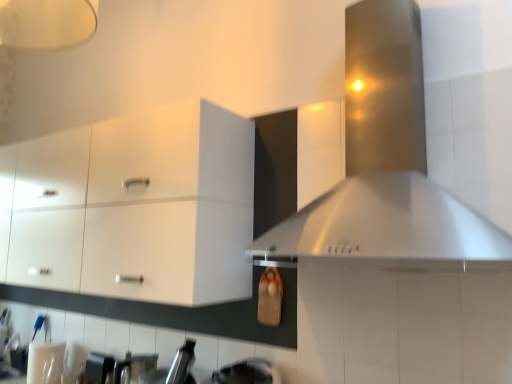
Find the location of a particular element. This screenshot has height=384, width=512. white glossy cabinet at upper left is located at coordinates pos(134,207).

What do you see at coordinates (98, 368) in the screenshot? I see `metallic silver toaster at lower left` at bounding box center [98, 368].

Locate an element on the screen. The width and height of the screenshot is (512, 384). white glossy cabinet at upper left is located at coordinates (134, 207).

Does point (104, 361) come closer to viewer compared to point (99, 273)?

No, it is not.

From a real-world perspective, which object stands above the other?

In real-world perspective, white glossy cabinet at upper left is above.

Measure the distance from metallic silver toaster at lower left to white glossy cabinet at upper left.

36.30 inches.

Based on their positions, is metallic silver toaster at lower left located to the left or right of white glossy cabinet at upper left?

From the image, it's evident that metallic silver toaster at lower left is to the right of white glossy cabinet at upper left.

Which is in front, stainless steel vent at upper right or metallic silver toaster at lower left?

Positioned in front is stainless steel vent at upper right.

At what (x,y) coordinates should I click in order to perform the action: click on appliance to the left of stainless steel vent at upper right. Please return your answer as a coordinate pair (x, y). Looking at the image, I should click on (98, 368).

Considering the sizes of stainless steel vent at upper right and metallic silver toaster at lower left in the image, is stainless steel vent at upper right wider or thinner than metallic silver toaster at lower left?

Clearly, stainless steel vent at upper right has more width compared to metallic silver toaster at lower left.

What's the angular difference between stainless steel vent at upper right and metallic silver toaster at lower left's facing directions?

The facing directions of stainless steel vent at upper right and metallic silver toaster at lower left are 0.855 degrees apart.

Looking at the image, does metallic silver toaster at lower left seem bigger or smaller compared to stainless steel vent at upper right?

In the image, metallic silver toaster at lower left appears to be smaller than stainless steel vent at upper right.

From the picture: From the image's perspective, between metallic silver toaster at lower left and stainless steel vent at upper right, which one is located above?

stainless steel vent at upper right appears higher in the image.

The height and width of the screenshot is (384, 512). Identify the location of appliance behind the stainless steel vent at upper right. (98, 368).

From a real-world perspective, between metallic silver toaster at lower left and stainless steel vent at upper right, who is vertically lower?

metallic silver toaster at lower left.

From the image's perspective, is white glossy cabinet at upper left on metallic silver toaster at lower left?

Correct, white glossy cabinet at upper left appears higher than metallic silver toaster at lower left in the image.

Is white glossy cabinet at upper left not within metallic silver toaster at lower left?

Yes, white glossy cabinet at upper left is not within metallic silver toaster at lower left.

Where is `appliance on the right of white glossy cabinet at upper left`? Image resolution: width=512 pixels, height=384 pixels. appliance on the right of white glossy cabinet at upper left is located at coordinates (98, 368).

Considering the relative sizes of white glossy cabinet at upper left and metallic silver toaster at lower left in the image provided, is white glossy cabinet at upper left wider than metallic silver toaster at lower left?

Yes, white glossy cabinet at upper left is wider than metallic silver toaster at lower left.

Considering the positions of objects stainless steel vent at upper right and white glossy cabinet at upper left in the image provided, who is in front, stainless steel vent at upper right or white glossy cabinet at upper left?

Positioned in front is stainless steel vent at upper right.

Looking at the image, does stainless steel vent at upper right seem bigger or smaller compared to white glossy cabinet at upper left?

In the image, stainless steel vent at upper right appears to be smaller than white glossy cabinet at upper left.

From the image's perspective, is stainless steel vent at upper right under white glossy cabinet at upper left?

No.

Where is `cabinetry behind the stainless steel vent at upper right`? Image resolution: width=512 pixels, height=384 pixels. cabinetry behind the stainless steel vent at upper right is located at coordinates (134, 207).

Which is correct: white glossy cabinet at upper left is inside stainless steel vent at upper right, or outside of it?

white glossy cabinet at upper left is not enclosed by stainless steel vent at upper right.

In terms of width, does white glossy cabinet at upper left look wider or thinner when compared to stainless steel vent at upper right?

Clearly, white glossy cabinet at upper left has less width compared to stainless steel vent at upper right.

From the image's perspective, which is above, white glossy cabinet at upper left or stainless steel vent at upper right?

stainless steel vent at upper right, from the image's perspective.

This screenshot has width=512, height=384. Identify the location of cabinetry located on the left of metallic silver toaster at lower left. (134, 207).

At what (x,y) coordinates should I click in order to perform the action: click on vent that appears in front of the metallic silver toaster at lower left. Please return your answer as a coordinate pair (x, y). Looking at the image, I should click on (433, 97).

Based on their spatial positions, is metallic silver toaster at lower left or white glossy cabinet at upper left closer to stainless steel vent at upper right?

white glossy cabinet at upper left lies closer to stainless steel vent at upper right than the other object.

Based on their spatial positions, is white glossy cabinet at upper left or metallic silver toaster at lower left further from stainless steel vent at upper right?

metallic silver toaster at lower left.

Considering their positions, is white glossy cabinet at upper left positioned further to metallic silver toaster at lower left than stainless steel vent at upper right?

stainless steel vent at upper right.

From the image, which object appears to be nearer to metallic silver toaster at lower left, stainless steel vent at upper right or white glossy cabinet at upper left?

white glossy cabinet at upper left.

Looking at the image, which one is located further to white glossy cabinet at upper left, metallic silver toaster at lower left or stainless steel vent at upper right?

The object further to white glossy cabinet at upper left is metallic silver toaster at lower left.

Looking at the image, which one is located further to white glossy cabinet at upper left, stainless steel vent at upper right or metallic silver toaster at lower left?

metallic silver toaster at lower left.

This screenshot has height=384, width=512. I want to click on appliance between white glossy cabinet at upper left and stainless steel vent at upper right from left to right, so click(x=98, y=368).